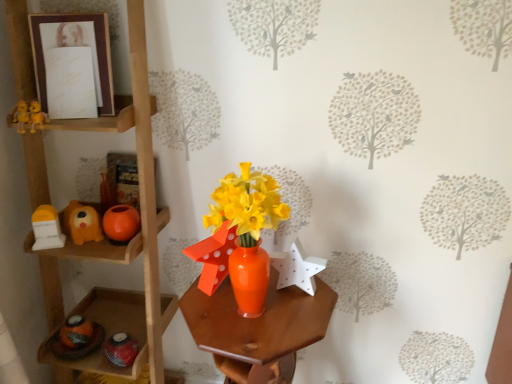
Where is `matte orange dog at left, the first toy when ordered from left to right`? The image size is (512, 384). matte orange dog at left, the first toy when ordered from left to right is located at coordinates (82, 223).

Describe the element at coordinates (82, 223) in the screenshot. I see `matte orange dog at left, the first toy when ordered from left to right` at that location.

At what (x,y) coordinates should I click in order to perform the action: click on orange glossy vase at center. Please return your answer as a coordinate pair (x, y). Looking at the image, I should click on (258, 329).

Is orange glossy vase at center further to the viewer compared to orange matte ball at left, acting as the 2th toy starting from the left?

No.

Identify the location of the 2nd toy positioned above the orange glossy vase at center (from a real-world perspective). (121, 224).

From the image's perspective, is orange glossy vase at center beneath orange matte ball at left, which appears as the second toy when viewed from the right?

Yes.

Are orange glossy vase at center and orange matte ball at left, which appears as the second toy when viewed from the right, making contact?

No, orange glossy vase at center is not beside orange matte ball at left, which appears as the second toy when viewed from the right.

Is orange matte ball at left, acting as the 2th toy starting from the left, oriented away from wooden shelf at left?

Yes, orange matte ball at left, acting as the 2th toy starting from the left, is positioned with its back facing wooden shelf at left.

From a real-world perspective, is orange matte ball at left, which appears as the second toy when viewed from the right, located higher than wooden shelf at left?

Yes, from a real-world perspective, orange matte ball at left, which appears as the second toy when viewed from the right, is above wooden shelf at left.

Are orange matte ball at left, acting as the 2th toy starting from the left, and wooden shelf at left beside each other?

orange matte ball at left, acting as the 2th toy starting from the left, is not next to wooden shelf at left, and they're not touching.

Find the location of a particular element. Image resolution: width=512 pixels, height=384 pixels. shelf below the orange matte ball at left, which appears as the second toy when viewed from the right (from the image's perspective) is located at coordinates (142, 213).

From the image's perspective, is matte brown picture frame at upper left on white matte star at center, the first toy viewed from the right?

Correct, matte brown picture frame at upper left appears higher than white matte star at center, the first toy viewed from the right, in the image.

Which is more to the right, matte brown picture frame at upper left or white matte star at center, which is counted as the third toy, starting from the left?

From the viewer's perspective, white matte star at center, which is counted as the third toy, starting from the left, appears more on the right side.

Consider the image. Considering the sizes of orange glossy vase at center and wooden shelf at left in the image, is orange glossy vase at center taller or shorter than wooden shelf at left?

orange glossy vase at center is shorter than wooden shelf at left.

Can we say orange glossy vase at center lies outside wooden shelf at left?

orange glossy vase at center lies outside wooden shelf at left's area.

From a real-world perspective, which object stands above the other?

From a 3D spatial view, wooden shelf at left is above.

Is orange matte ball at left, acting as the 2th toy starting from the left, oriented towards matte orange dog at left, positioned as the third toy in right-to-left order?

No, orange matte ball at left, acting as the 2th toy starting from the left, is not turned towards matte orange dog at left, positioned as the third toy in right-to-left order.

How far apart are orange matte ball at left, acting as the 2th toy starting from the left, and matte orange dog at left, the first toy when ordered from left to right?

The distance of orange matte ball at left, acting as the 2th toy starting from the left, from matte orange dog at left, the first toy when ordered from left to right, is 2.81 inches.

From a real-world perspective, is orange matte ball at left, acting as the 2th toy starting from the left, on top of matte orange dog at left, positioned as the third toy in right-to-left order?

Actually, orange matte ball at left, acting as the 2th toy starting from the left, is physically below matte orange dog at left, positioned as the third toy in right-to-left order, in the real world.

Considering the positions of objects orange matte ball at left, acting as the 2th toy starting from the left, and matte orange dog at left, the first toy when ordered from left to right, in the image provided, who is behind, orange matte ball at left, acting as the 2th toy starting from the left, or matte orange dog at left, the first toy when ordered from left to right,?

orange matte ball at left, acting as the 2th toy starting from the left.

Which of these two, matte brown picture frame at upper left or wooden shelf at left, stands shorter?

With less height is matte brown picture frame at upper left.

Which object is thinner, matte brown picture frame at upper left or wooden shelf at left?

Thinner between the two is matte brown picture frame at upper left.

Is matte brown picture frame at upper left facing towards wooden shelf at left?

Yes, matte brown picture frame at upper left is facing wooden shelf at left.

Does point (37, 76) appear closer or farther from the camera than point (141, 150)?

Point (37, 76) is positioned farther from the camera compared to point (141, 150).

Would you say wooden shelf at left is outside matte orange dog at left, positioned as the third toy in right-to-left order?

wooden shelf at left lies outside matte orange dog at left, positioned as the third toy in right-to-left order,'s area.

Which of these two, wooden shelf at left or matte orange dog at left, positioned as the third toy in right-to-left order, stands shorter?

matte orange dog at left, positioned as the third toy in right-to-left order, is shorter.

Would you consider wooden shelf at left to be distant from matte orange dog at left, positioned as the third toy in right-to-left order?

No, wooden shelf at left is in close proximity to matte orange dog at left, positioned as the third toy in right-to-left order.

Is matte orange dog at left, the first toy when ordered from left to right, at the back of wooden shelf at left?

Yes, wooden shelf at left's orientation is away from matte orange dog at left, the first toy when ordered from left to right.

At what (x,y) coordinates should I click in order to perform the action: click on the 2nd toy positioned above the orange glossy vase at center (from a real-world perspective). Please return your answer as a coordinate pair (x, y). The width and height of the screenshot is (512, 384). Looking at the image, I should click on (121, 224).

This screenshot has height=384, width=512. I want to click on shelf below the orange matte ball at left, acting as the 2th toy starting from the left (from a real-world perspective), so click(142, 213).

Based on the photo, estimate the real-world distances between objects in this image. Which object is closer to white matte star at center, which is counted as the third toy, starting from the left, wooden shelf at left or orange glossy vase at center?

orange glossy vase at center is closer to white matte star at center, which is counted as the third toy, starting from the left.

Which object lies nearer to the anchor point orange glossy vase at center, white matte star at center, which is counted as the third toy, starting from the left, or matte brown picture frame at upper left?

white matte star at center, which is counted as the third toy, starting from the left.

From the image, which object appears to be nearer to matte orange dog at left, the first toy when ordered from left to right, wooden shelf at left or orange glossy vase at center?

Among the two, wooden shelf at left is located nearer to matte orange dog at left, the first toy when ordered from left to right.

Estimate the real-world distances between objects in this image. Which object is closer to wooden shelf at left, white matte star at center, the first toy viewed from the right, or orange matte ball at left, acting as the 2th toy starting from the left?

orange matte ball at left, acting as the 2th toy starting from the left.

Looking at the image, which one is located closer to matte brown picture frame at upper left, orange glossy vase at center or matte orange dog at left, the first toy when ordered from left to right?

The object closer to matte brown picture frame at upper left is matte orange dog at left, the first toy when ordered from left to right.

Based on their spatial positions, is orange glossy vase at center or orange matte ball at left, which appears as the second toy when viewed from the right, closer to white matte star at center, the first toy viewed from the right?

orange glossy vase at center lies closer to white matte star at center, the first toy viewed from the right, than the other object.

From the image, which object appears to be farther from white matte star at center, which is counted as the third toy, starting from the left, orange matte ball at left, acting as the 2th toy starting from the left, or matte brown picture frame at upper left?

matte brown picture frame at upper left lies further to white matte star at center, which is counted as the third toy, starting from the left, than the other object.

Which object lies further to the anchor point white matte star at center, which is counted as the third toy, starting from the left, wooden shelf at left or orange matte ball at left, acting as the 2th toy starting from the left?

wooden shelf at left lies further to white matte star at center, which is counted as the third toy, starting from the left, than the other object.

You are a GUI agent. You are given a task and a screenshot of the screen. Output one action in this format:
    pyautogui.click(x=<x>, y=<y>)
    Task: Click on the table between orange matte ball at left, which appears as the second toy when viewed from the right, and white matte star at center, which is counted as the third toy, starting from the left, from left to right
    The height and width of the screenshot is (384, 512).
    Given the screenshot: What is the action you would take?
    pyautogui.click(x=258, y=329)

Locate an element on the screen. toy located between matte orange dog at left, the first toy when ordered from left to right, and white matte star at center, which is counted as the third toy, starting from the left, in the left-right direction is located at coordinates (121, 224).

Locate an element on the screen. This screenshot has width=512, height=384. toy between matte brown picture frame at upper left and white matte star at center, which is counted as the third toy, starting from the left, in the horizontal direction is located at coordinates (121, 224).

Find the location of a particular element. This screenshot has height=384, width=512. shelf located between matte orange dog at left, the first toy when ordered from left to right, and white matte star at center, the first toy viewed from the right, in the left-right direction is located at coordinates (142, 213).